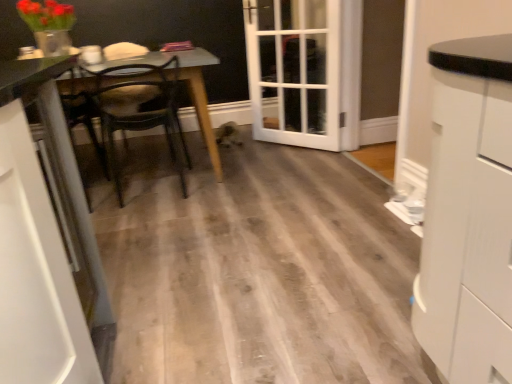
This screenshot has height=384, width=512. Identify the location of vacant area that lies to the right of wooden chair at center. (246, 179).